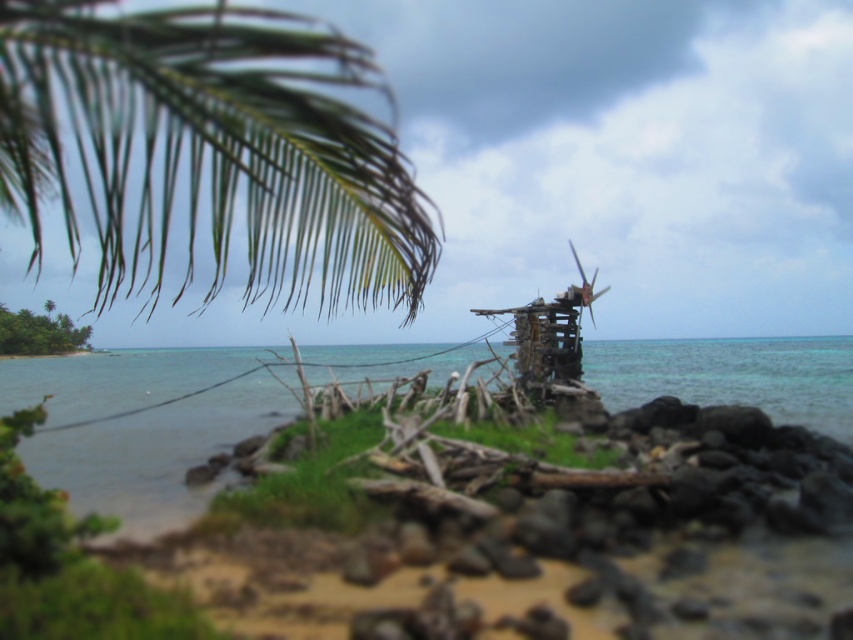
Does green leafy palm at upper left have a lesser height compared to clear blue water at center?

Indeed, green leafy palm at upper left has a lesser height compared to clear blue water at center.

Between green leafy palm at upper left and clear blue water at center, which one is positioned higher?

green leafy palm at upper left is higher up.

Does point (293, 45) come farther from viewer compared to point (128, 524)?

No, (293, 45) is closer to viewer.

Image resolution: width=853 pixels, height=640 pixels. I want to click on green leafy palm at upper left, so click(x=212, y=150).